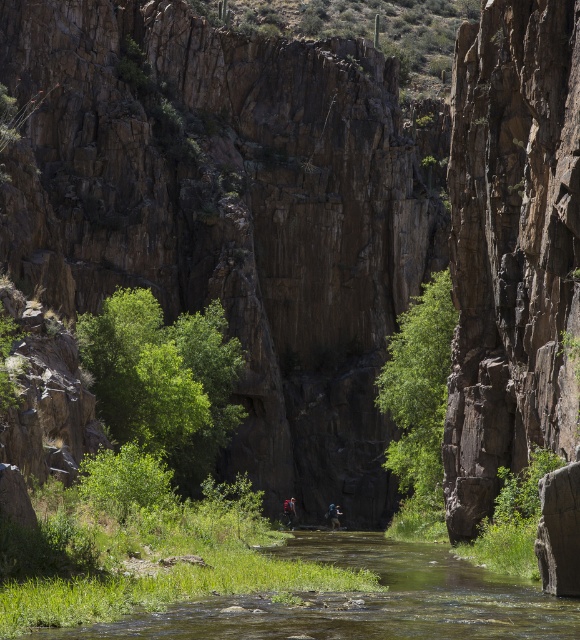
You are standing at the point marked by the coordinates point (361, 600) in the canyon scene. What do you see directly in front of you?

The point (361, 600) marks the green grassy stream at center, so directly in front of you is the green grassy stream at center.

You are standing at the edge of the canyon and see the green grassy stream at center and the camouflage fabric backpack at center. If you want to reach the backpack first before the stream, which direction should you walk? Please provide the answer in meters and specify the direction relative to the backpack.

The green grassy stream at center and camouflage fabric backpack at center are 37.88 meters apart. To reach the backpack before the stream, you should walk away from the stream towards the backpack in the direction opposite to the stream, covering a distance of 37.88 meters.

You are standing at the edge of the canyon and see both the camouflage fabric backpack at center and the blue fabric backpack at center. Which backpack is nearer to you?

The camouflage fabric backpack at center is closer to the viewer than the blue fabric backpack at center, so the camouflage one is nearer.